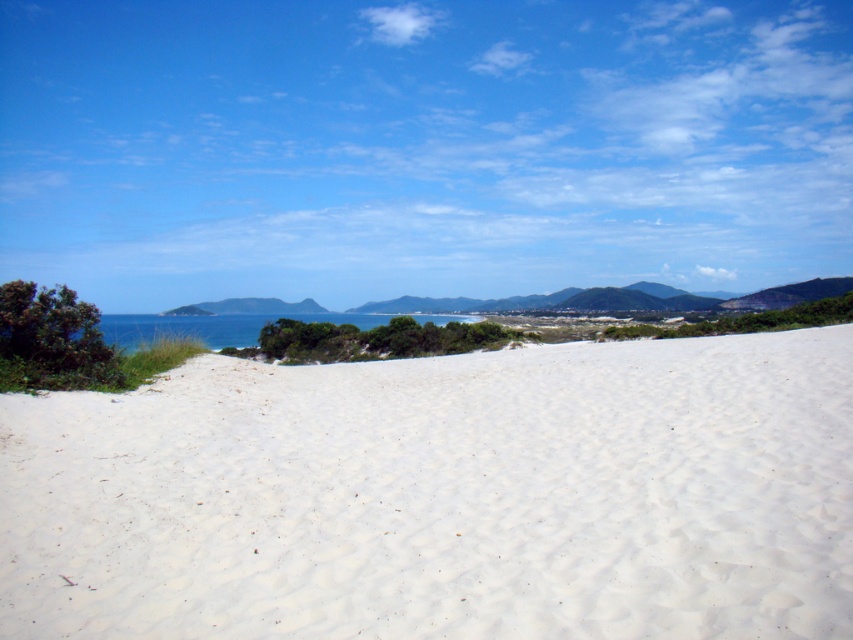
You are planning to build a small cabin on the white sandy beach at center and the blue water at center. Which location would provide more space for the cabin?

The blue water at center has a larger area than the white sandy beach at center, so building the cabin on the blue water at center would provide more space. However, constructing on water may not be feasible without proper infrastructure. The white sandy beach at center, though smaller, is a solid ground for construction.

You are standing at the point closest to the viewer in the image. Which point, point (453, 452) or point (152, 339), is closer to you?

Point (453, 452) is in front of point (152, 339), so it is closer to you.

You are standing on the white sandy beach at center and want to reach the blue water at center. Which direction should you move to get there?

You should move to the left because the white sandy beach at center is to the right of the blue water at center, so moving left will take you towards the blue water at center.